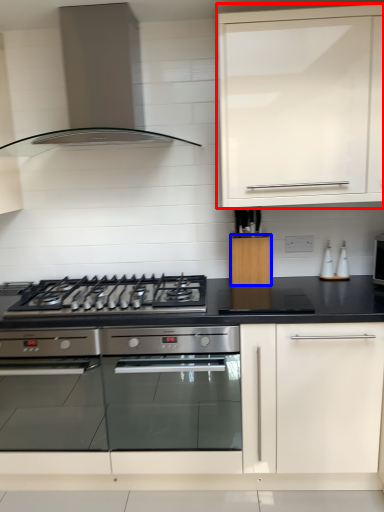
Question: Which object is further to the camera taking this photo, cabinetry (highlighted by a red box) or cabinetry (highlighted by a blue box)?

Choices:
 (A) cabinetry
 (B) cabinetry

Answer: (B)